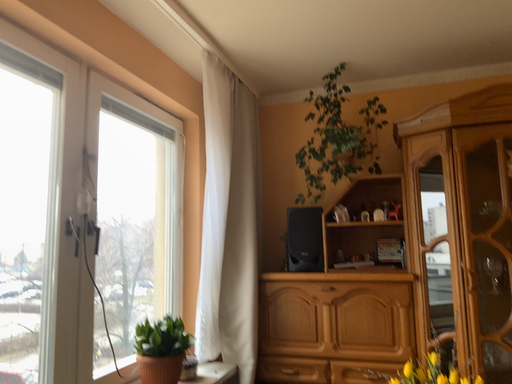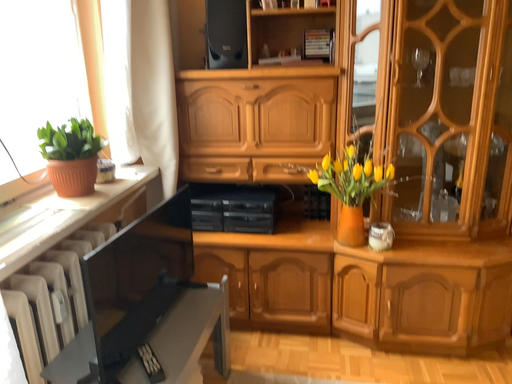
Question: How did the camera likely rotate when shooting the video?

Choices:
 (A) rotated downward
 (B) rotated upward

Answer: (A)